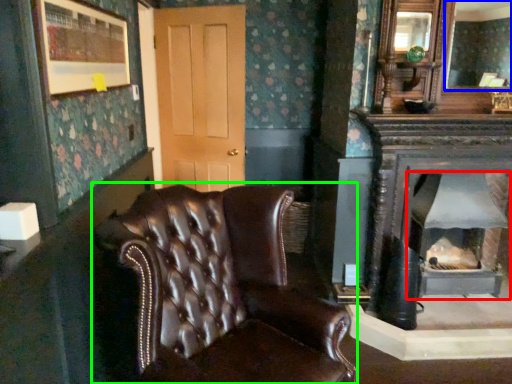
Question: Estimate the real-world distances between objects in this image. Which object is farther from wood burning stove (highlighted by a red box), mirror (highlighted by a blue box) or chair (highlighted by a green box)?

Choices:
 (A) mirror
 (B) chair

Answer: (A)